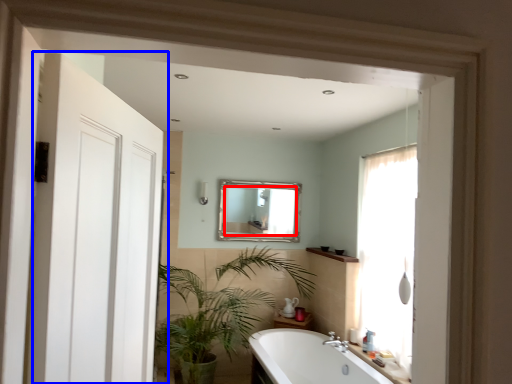
Question: Among these objects, which one is farthest to the camera, mirror (highlighted by a red box) or door (highlighted by a blue box)?

Choices:
 (A) mirror
 (B) door

Answer: (A)